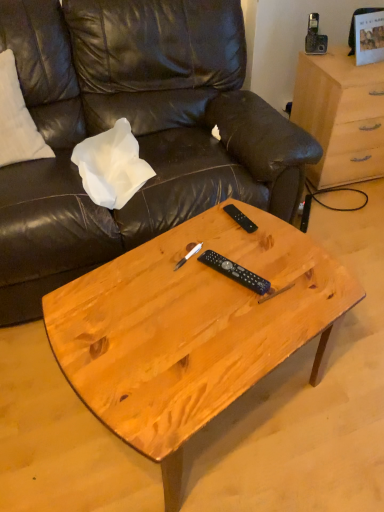
You are a GUI agent. You are given a task and a screenshot of the screen. Output one action in this format:
    pyautogui.click(x=<x>, y=<y>)
    Task: Click on the white paper at upper left
    The height and width of the screenshot is (512, 384).
    Given the screenshot: What is the action you would take?
    pyautogui.click(x=111, y=166)

Describe the element at coordinates (111, 166) in the screenshot. The height and width of the screenshot is (512, 384). I see `white paper at upper left` at that location.

What do you see at coordinates (240, 218) in the screenshot? Image resolution: width=384 pixels, height=512 pixels. I see `black plastic remote at center, arranged as the 1th remote when viewed from the back` at bounding box center [240, 218].

Image resolution: width=384 pixels, height=512 pixels. Find the location of `light brown wood desk at upper right`. light brown wood desk at upper right is located at coordinates pyautogui.click(x=341, y=116).

Considering the relative positions of black plastic remote at center, marked as the 1th remote in a top-to-bottom arrangement, and natural wood coffee table at center in the image provided, is black plastic remote at center, marked as the 1th remote in a top-to-bottom arrangement, in front of natural wood coffee table at center?

No, black plastic remote at center, marked as the 1th remote in a top-to-bottom arrangement, is behind natural wood coffee table at center.

Considering the relative sizes of black plastic remote at center, placed as the second remote when sorted from bottom to top, and natural wood coffee table at center in the image provided, is black plastic remote at center, placed as the second remote when sorted from bottom to top, bigger than natural wood coffee table at center?

Incorrect, black plastic remote at center, placed as the second remote when sorted from bottom to top, is not larger than natural wood coffee table at center.

From the image's perspective, between black plastic remote at center, placed as the second remote when sorted from bottom to top, and natural wood coffee table at center, who is located below?

natural wood coffee table at center is shown below in the image.

Image resolution: width=384 pixels, height=512 pixels. I want to click on coffee table below the black plastic remote at center, which is the 2th remote in front-to-back order (from the image's perspective), so click(x=192, y=329).

Considering the sizes of black plastic remote at center, marked as the 1th remote in a top-to-bottom arrangement, and black plastic remote at center, the 1th remote viewed from the front, in the image, is black plastic remote at center, marked as the 1th remote in a top-to-bottom arrangement, wider or thinner than black plastic remote at center, the 1th remote viewed from the front,?

black plastic remote at center, marked as the 1th remote in a top-to-bottom arrangement, is thinner than black plastic remote at center, the 1th remote viewed from the front.

From the image's perspective, which one is positioned lower, black plastic remote at center, which is the 2th remote in front-to-back order, or black plastic remote at center, the second remote in the back-to-front sequence?

black plastic remote at center, the second remote in the back-to-front sequence.

From a real-world perspective, between black plastic remote at center, marked as the 1th remote in a top-to-bottom arrangement, and black plastic remote at center, the second remote in the back-to-front sequence, who is vertically higher?

black plastic remote at center, the second remote in the back-to-front sequence, from a real-world perspective.

In the scene shown: Which point is more distant from viewer, (228, 211) or (226, 261)?

The point (228, 211) is farther.

Is light brown wood desk at upper right not close to white paper at upper left?

That's right, there is a large distance between light brown wood desk at upper right and white paper at upper left.

Which is correct: light brown wood desk at upper right is inside white paper at upper left, or outside of it?

light brown wood desk at upper right is spatially situated outside white paper at upper left.

From the picture: Considering the relative positions of light brown wood desk at upper right and white paper at upper left in the image provided, is light brown wood desk at upper right to the left or to the right of white paper at upper left?

From the image, it's evident that light brown wood desk at upper right is to the right of white paper at upper left.

Measure the distance from light brown wood desk at upper right to white paper at upper left.

light brown wood desk at upper right and white paper at upper left are 1.03 meters apart from each other.

From a real-world perspective, is black plastic remote at center, the 1th remote viewed from the front, above or below white paper at upper left?

black plastic remote at center, the 1th remote viewed from the front, is situated higher than white paper at upper left in the real world.

Is black plastic remote at center, acting as the 2th remote starting from the top, completely or partially outside of white paper at upper left?

Absolutely, black plastic remote at center, acting as the 2th remote starting from the top, is external to white paper at upper left.

From the image's perspective, is black plastic remote at center, the 1th remote viewed from the front, located above white paper at upper left?

No, from the image's perspective, black plastic remote at center, the 1th remote viewed from the front, is not on top of white paper at upper left.

Is point (253, 278) behind point (112, 164)?

No, it is in front of (112, 164).

Is leather couch at center turned away from black plastic remote at center, arranged as the 1th remote when viewed from the back?

No, leather couch at center's orientation is not away from black plastic remote at center, arranged as the 1th remote when viewed from the back.

Between leather couch at center and black plastic remote at center, marked as the 1th remote in a top-to-bottom arrangement, which one has larger width?

leather couch at center.

Would you say leather couch at center contains black plastic remote at center, placed as the second remote when sorted from bottom to top?

No, black plastic remote at center, placed as the second remote when sorted from bottom to top, is not surrounded by leather couch at center.

Is leather couch at center touching black plastic remote at center, marked as the 1th remote in a top-to-bottom arrangement?

No, leather couch at center is not making contact with black plastic remote at center, marked as the 1th remote in a top-to-bottom arrangement.

Between black plastic remote at center, the 1th remote positioned from the bottom, and black plastic remote at center, which is the 2th remote in front-to-back order, which one has less height?

black plastic remote at center, which is the 2th remote in front-to-back order, is shorter.

The width and height of the screenshot is (384, 512). What are the coordinates of `remote beneath the black plastic remote at center, the 1th remote viewed from the front (from a real-world perspective)` in the screenshot? It's located at (240, 218).

From the image's perspective, which is above, black plastic remote at center, the 1th remote viewed from the front, or black plastic remote at center, placed as the second remote when sorted from bottom to top?

black plastic remote at center, placed as the second remote when sorted from bottom to top, appears higher in the image.

Looking at this image, are black plastic remote at center, the second remote in the back-to-front sequence, and black plastic remote at center, placed as the second remote when sorted from bottom to top, beside each other?

No, black plastic remote at center, the second remote in the back-to-front sequence, is not touching black plastic remote at center, placed as the second remote when sorted from bottom to top.

The width and height of the screenshot is (384, 512). I want to click on desk behind the white paper at upper left, so tap(341, 116).

Which object is closer to the camera, white paper at upper left or light brown wood desk at upper right?

Positioned in front is white paper at upper left.

Considering the relative sizes of white paper at upper left and light brown wood desk at upper right in the image provided, is white paper at upper left thinner than light brown wood desk at upper right?

Yes.

Which is more to the left, white paper at upper left or light brown wood desk at upper right?

From the viewer's perspective, white paper at upper left appears more on the left side.

In the image, there is a black plastic remote at center, arranged as the 1th remote when viewed from the back. Where is `coffee table below it (from a real-world perspective)`? This screenshot has width=384, height=512. coffee table below it (from a real-world perspective) is located at coordinates (192, 329).

Image resolution: width=384 pixels, height=512 pixels. In the image, there is a black plastic remote at center, placed as the second remote when sorted from bottom to top. In order to click on remote below it (from the image's perspective) in this screenshot , I will do `click(235, 272)`.

Considering their positions, is black plastic remote at center, acting as the 2th remote starting from the top, positioned closer to black plastic remote at center, placed as the second remote when sorted from bottom to top, than natural wood coffee table at center?

The object closer to black plastic remote at center, placed as the second remote when sorted from bottom to top, is black plastic remote at center, acting as the 2th remote starting from the top.

Which object lies further to the anchor point light brown wood desk at upper right, white paper at upper left or black plastic remote at center, placed as the second remote when sorted from bottom to top?

The object further to light brown wood desk at upper right is black plastic remote at center, placed as the second remote when sorted from bottom to top.

In the scene shown: Which object lies nearer to the anchor point leather couch at center, natural wood coffee table at center or black plastic remote at center, acting as the 2th remote starting from the top?

natural wood coffee table at center.

When comparing their distances from light brown wood desk at upper right, does natural wood coffee table at center or leather couch at center seem closer?

Based on the image, leather couch at center appears to be nearer to light brown wood desk at upper right.

Looking at the image, which one is located further to black plastic remote at center, acting as the 2th remote starting from the top, natural wood coffee table at center or light brown wood desk at upper right?

Among the two, light brown wood desk at upper right is located further to black plastic remote at center, acting as the 2th remote starting from the top.

Considering their positions, is light brown wood desk at upper right positioned closer to white paper at upper left than natural wood coffee table at center?

natural wood coffee table at center is closer to white paper at upper left.

Consider the image. From the image, which object appears to be nearer to leather couch at center, light brown wood desk at upper right or black plastic remote at center, the second remote in the back-to-front sequence?

Based on the image, light brown wood desk at upper right appears to be nearer to leather couch at center.

Based on their spatial positions, is black plastic remote at center, the 1th remote positioned from the bottom, or black plastic remote at center, marked as the 1th remote in a top-to-bottom arrangement, closer to natural wood coffee table at center?

black plastic remote at center, the 1th remote positioned from the bottom, lies closer to natural wood coffee table at center than the other object.

Where is `studio couch between natural wood coffee table at center and light brown wood desk at upper right from front to back`? The height and width of the screenshot is (512, 384). studio couch between natural wood coffee table at center and light brown wood desk at upper right from front to back is located at coordinates (133, 132).

At what (x,y) coordinates should I click in order to perform the action: click on studio couch located between white paper at upper left and light brown wood desk at upper right in the left-right direction. Please return your answer as a coordinate pair (x, y). The image size is (384, 512). Looking at the image, I should click on (133, 132).

Find the location of a particular element. This screenshot has width=384, height=512. remote between natural wood coffee table at center and black plastic remote at center, arranged as the 1th remote when viewed from the back, in the front-back direction is located at coordinates (235, 272).

The image size is (384, 512). In order to click on pillow between leather couch at center and black plastic remote at center, the second remote in the back-to-front sequence, in the up-down direction in this screenshot , I will do `click(111, 166)`.